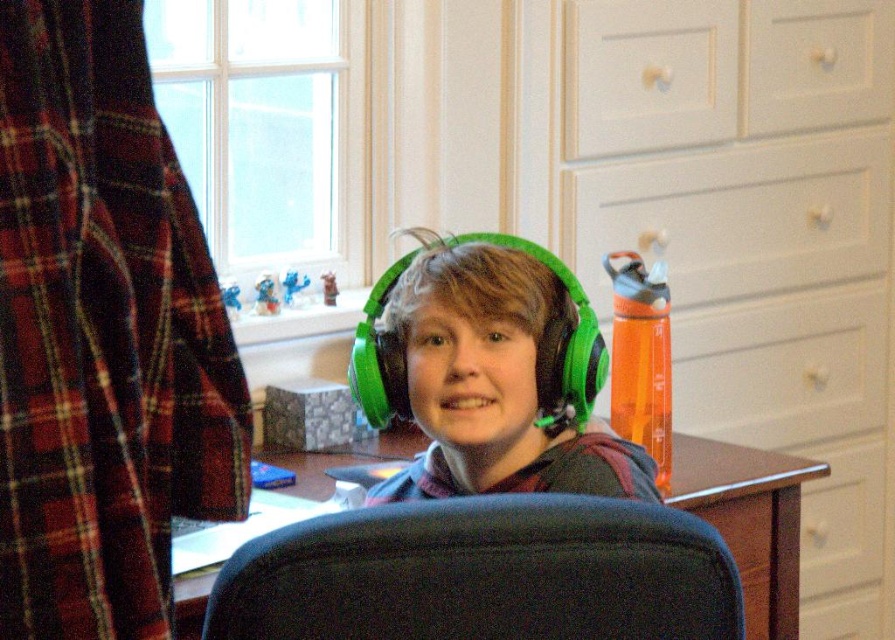
Who is more distant from viewer, [700,26] or [871,106]?

Point [871,106]

Is white matte drawer at upper center bigger than white matte drawer at upper right?

Indeed, white matte drawer at upper center has a larger size compared to white matte drawer at upper right.

Who is more forward, (657, 8) or (829, 113)?

Point (657, 8)

Locate an element on the screen. This screenshot has height=640, width=895. white matte drawer at upper center is located at coordinates (646, 74).

Between point (569, 636) and point (748, 49), which one is positioned in front?

Point (569, 636) is more forward.

Is black fabric swivel chair at center closer to camera compared to white matte drawer at upper right?

Yes.

Consider the image. Measure the distance between point (x=399, y=579) and camera.

Point (x=399, y=579) and camera are 91.20 centimeters apart.

Where is `black fabric swivel chair at center`? Image resolution: width=895 pixels, height=640 pixels. black fabric swivel chair at center is located at coordinates (483, 573).

Who is positioned more to the right, matte orange plastic water bottle at center or white matte drawer at upper center?

Positioned to the right is matte orange plastic water bottle at center.

Can you confirm if matte orange plastic water bottle at center is shorter than white matte drawer at upper center?

In fact, matte orange plastic water bottle at center may be taller than white matte drawer at upper center.

Locate an element on the screen. This screenshot has width=895, height=640. matte orange plastic water bottle at center is located at coordinates (696, 214).